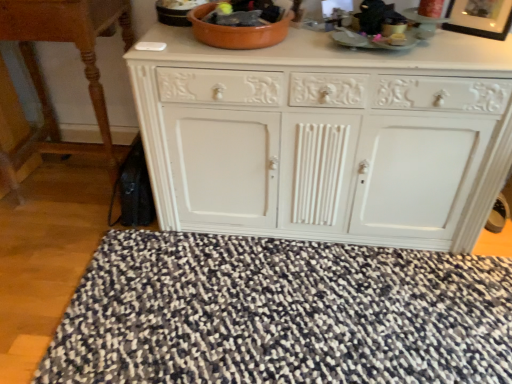
Question: Is white painted wood cabinet at center wider or thinner than wooden table at left?

Choices:
 (A) thin
 (B) wide

Answer: (B)

Question: Choose the correct answer: Is white painted wood cabinet at center inside wooden table at left or outside it?

Choices:
 (A) outside
 (B) inside

Answer: (A)

Question: Considering the real-world distances, which object is closest to the white painted wood cabinet at center?

Choices:
 (A) speckled fabric doormat at lower center
 (B) wooden table at left
 (C) black glossy picture frame at upper right

Answer: (A)

Question: Which is farther from the white painted wood cabinet at center?

Choices:
 (A) wooden table at left
 (B) speckled fabric doormat at lower center
 (C) black glossy picture frame at upper right

Answer: (A)